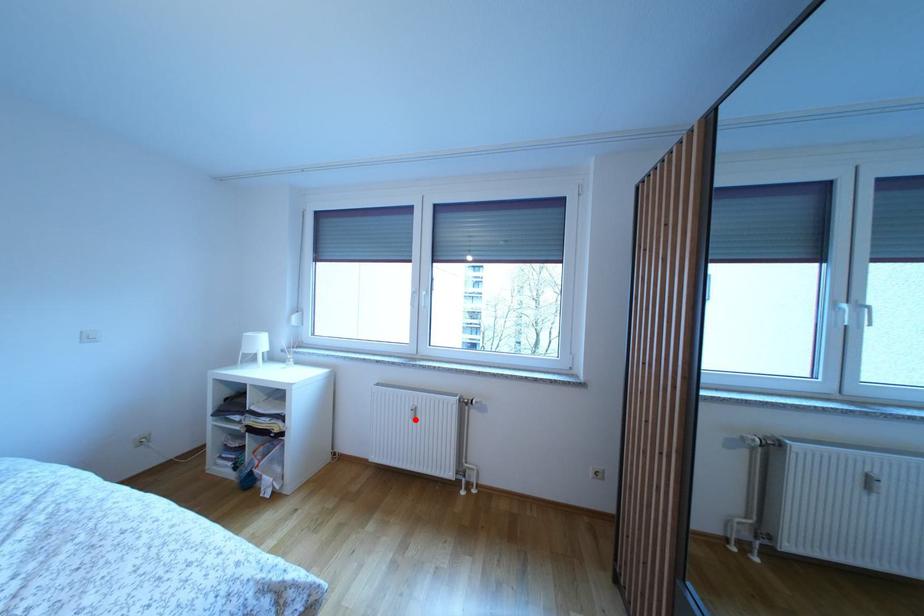
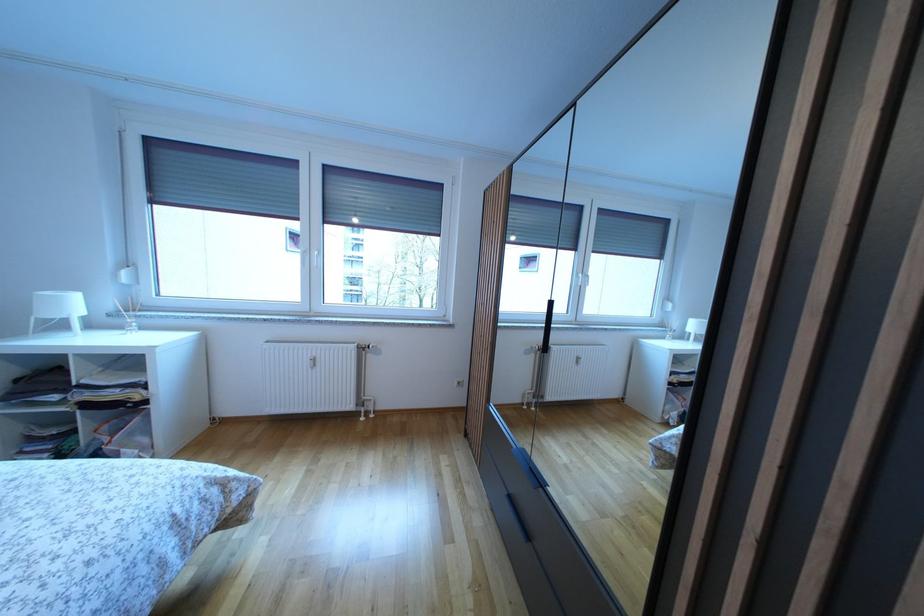
In the second image, find the point that corresponds to the highlighted location in the first image.

(314, 370)